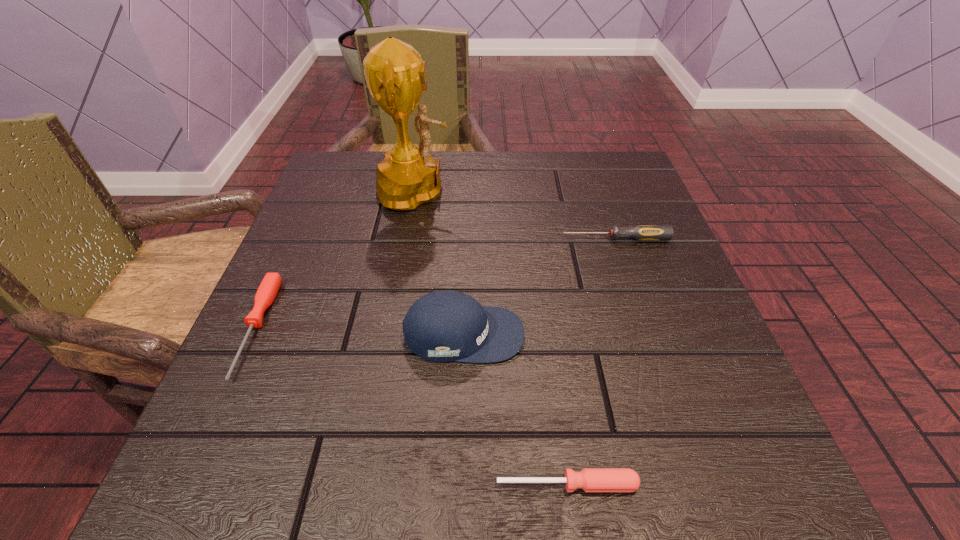
You are a GUI agent. You are given a task and a screenshot of the screen. Output one action in this format:
    pyautogui.click(x=<x>, y=<y>)
    Task: Click on the vacant space that satisfies the following two spatial constraints: 1. at the tip of the second nearest screwdriver; 2. on the right side of the nearest screwdriver
    
    Given the screenshot: What is the action you would take?
    pyautogui.click(x=184, y=484)

Identify the location of free location that satisfies the following two spatial constraints: 1. on the front-facing side of the second tallest object; 2. on the back side of the nearest screwdriver. The height and width of the screenshot is (540, 960). (459, 484).